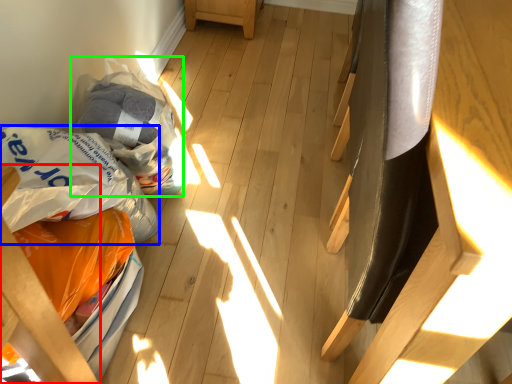
Question: Estimate the real-world distances between objects in this image. Which object is farther from furniture (highlighted by a red box), grocery bag (highlighted by a blue box) or grocery bag (highlighted by a green box)?

Choices:
 (A) grocery bag
 (B) grocery bag

Answer: (B)